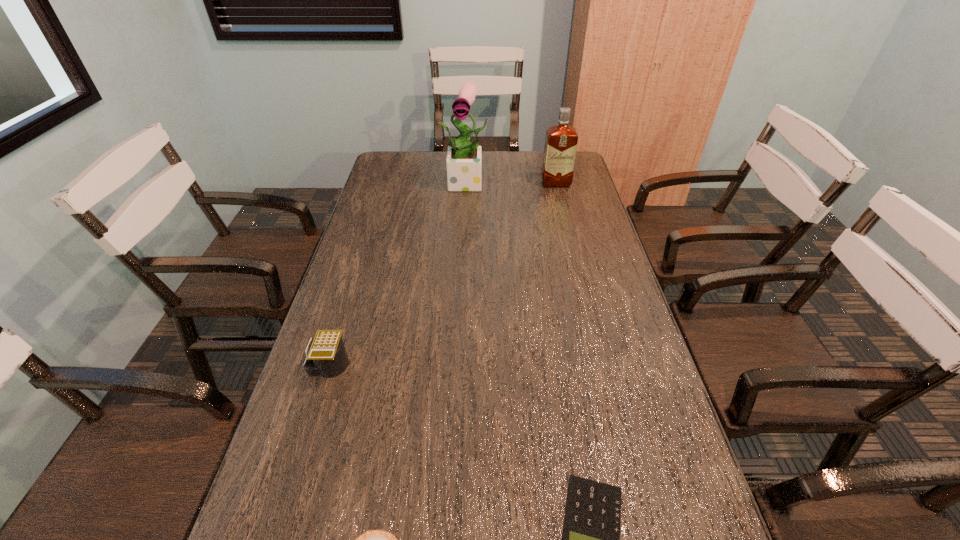
Where is `free point between the flower arrangement and the left calculator`? The width and height of the screenshot is (960, 540). free point between the flower arrangement and the left calculator is located at coordinates (398, 274).

Where is `the third closest object relative to the fourth tallest object`? Image resolution: width=960 pixels, height=540 pixels. the third closest object relative to the fourth tallest object is located at coordinates (463, 162).

Where is `object that is the third closest to the right calculator`? object that is the third closest to the right calculator is located at coordinates (463, 162).